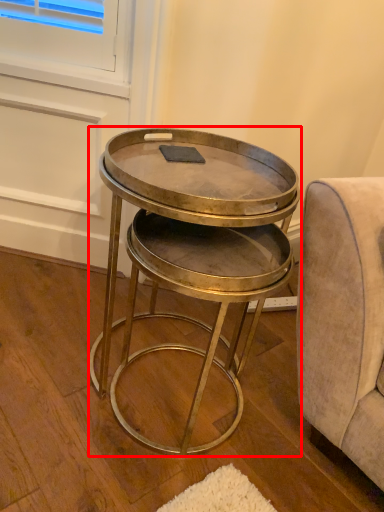
Question: From the image's perspective, where is table (annotated by the red box) located in relation to pad in the image?

Choices:
 (A) above
 (B) below

Answer: (B)